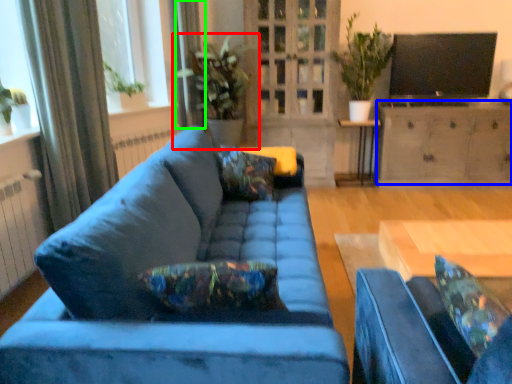
Question: Which is nearer to the houseplant (highlighted by a red box)? cabinetry (highlighted by a blue box) or curtain (highlighted by a green box).

Choices:
 (A) cabinetry
 (B) curtain

Answer: (B)